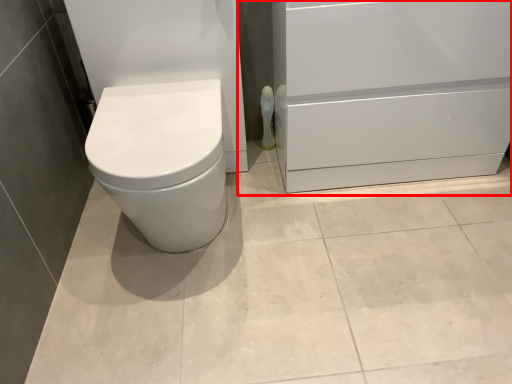
Question: From the image's perspective, considering the relative positions of file cabinet (annotated by the red box) and toilet paper in the image provided, where is file cabinet (annotated by the red box) located with respect to the staircase?

Choices:
 (A) above
 (B) below

Answer: (A)